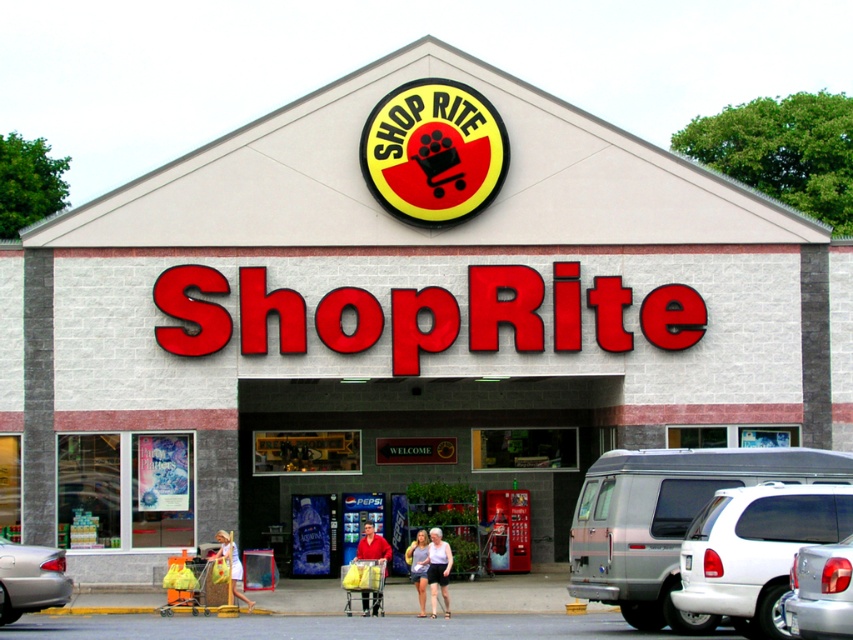
Who is higher up, red cotton shirt at center or light blue denim shorts at center?

red cotton shirt at center

Who is taller, red cotton shirt at center or light blue denim shorts at center?

Standing taller between the two is light blue denim shorts at center.

Is point (364, 550) positioned in front of point (421, 560)?

No.

Locate an element on the screen. red cotton shirt at center is located at coordinates (372, 545).

Is point (44, 547) farther from viewer compared to point (436, 547)?

No, it is in front of (436, 547).

From the picture: Is silver metallic sedan at lower left to the left of white cotton shirt at center from the viewer's perspective?

Indeed, silver metallic sedan at lower left is positioned on the left side of white cotton shirt at center.

Does point (36, 584) come in front of point (442, 596)?

Yes, it is.

Identify the location of silver metallic sedan at lower left. (30, 579).

Who is taller, silver metallic van at center or white cotton dress at center?

white cotton dress at center is taller.

Which is more to the right, silver metallic van at center or white cotton dress at center?

silver metallic van at center

Is point (845, 579) positioned in front of point (238, 564)?

Yes, point (845, 579) is in front of point (238, 564).

Image resolution: width=853 pixels, height=640 pixels. Find the location of `silver metallic van at center`. silver metallic van at center is located at coordinates (821, 592).